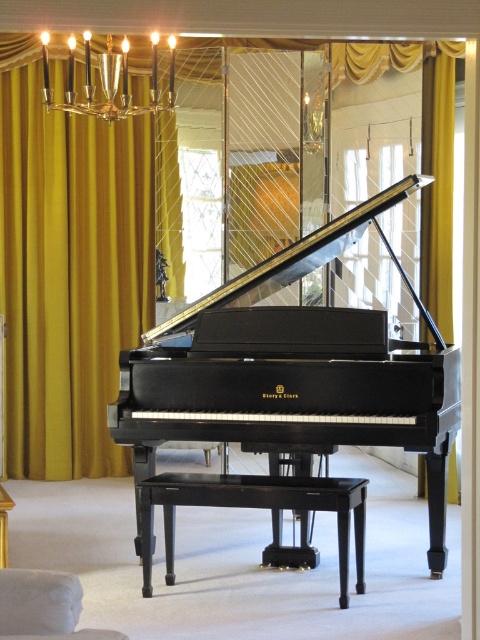
Who is shorter, white fabric armchair at lower left or gold metallic chandelier at upper center?

Standing shorter between the two is white fabric armchair at lower left.

Is white fabric armchair at lower left shorter than gold metallic chandelier at upper center?

Indeed, white fabric armchair at lower left has a lesser height compared to gold metallic chandelier at upper center.

This screenshot has width=480, height=640. What do you see at coordinates (44, 605) in the screenshot?
I see `white fabric armchair at lower left` at bounding box center [44, 605].

Locate an element on the screen. This screenshot has height=640, width=480. white fabric armchair at lower left is located at coordinates (44, 605).

Who is more distant from viewer, (252, 77) or (239, 490)?

The point (252, 77) is more distant.

Is point (75, 314) closer to camera compared to point (247, 346)?

No.

Where is `yellow velvet curtain at upper left`? yellow velvet curtain at upper left is located at coordinates (169, 211).

Which is in front, point (360, 545) or point (155, 33)?

Point (155, 33) is more forward.

Does point (320, 492) come farther from viewer compared to point (128, 51)?

No.

At what (x,y) coordinates should I click in order to perform the action: click on black polished wood stool at center. Please return your answer as a coordinate pair (x, y). Looking at the image, I should click on (253, 508).